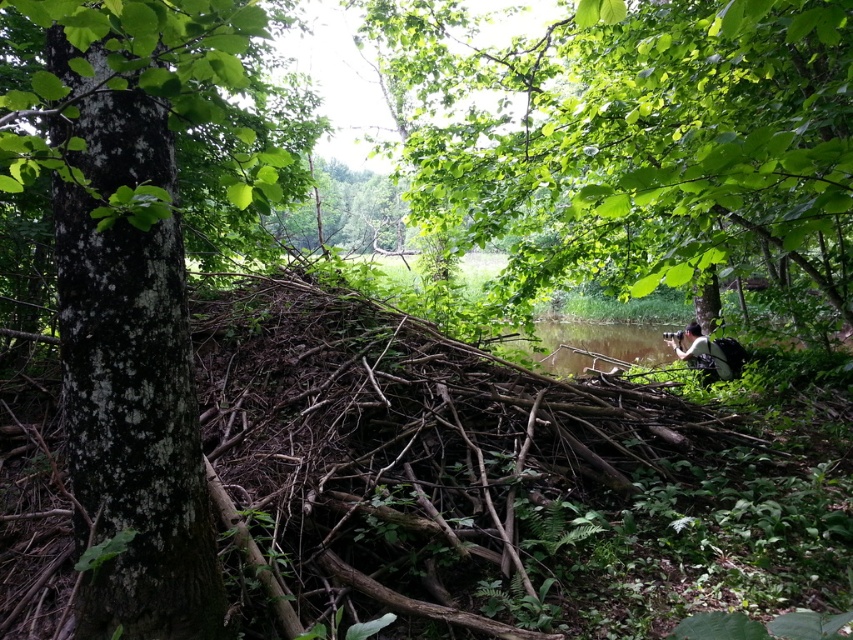
Measure the distance between green leafy tree at center and green rough bark tree at left.

They are 38.97 inches apart.

Who is positioned more to the right, green leafy tree at center or green rough bark tree at left?

green leafy tree at center is more to the right.

Who is more forward, (428, 76) or (131, 36)?

Positioned in front is point (131, 36).

I want to click on green leafy tree at center, so click(x=636, y=140).

Is green leafy tree at center below white fabric camera at center-right?

Actually, green leafy tree at center is above white fabric camera at center-right.

Between point (701, 227) and point (695, 365), which one is positioned behind?

The point (695, 365) is behind.

Find the location of a particular element. The image size is (853, 640). green leafy tree at center is located at coordinates (636, 140).

Who is more distant from viewer, [148,221] or [711,340]?

Positioned behind is point [711,340].

Between green rough bark tree at left and white fabric camera at center-right, which one has less height?

With less height is white fabric camera at center-right.

This screenshot has height=640, width=853. Find the location of `green rough bark tree at left`. green rough bark tree at left is located at coordinates (129, 289).